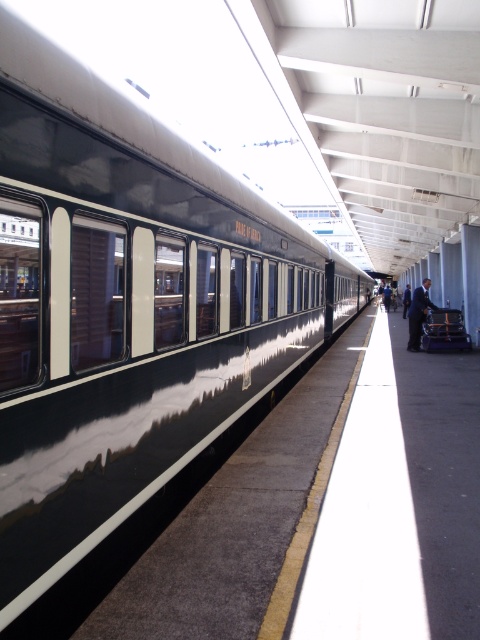
You are a photographer waiting at the train station platform. You want to take a photo of the dark blue suit at right and the black suit at right so that both are fully visible in the frame. Which suit should you position closer to the camera to ensure both are visible without cropping?

You should position the dark blue suit at right closer to the camera because it has a lesser width than the black suit at right, making it easier to fit both into the frame without cropping.

Consider the image. You are a passenger on the platform waiting for the train. You notice two people wearing suits. The dark blue suit at platform right and the black suit at right. Which person is shorter?

The dark blue suit at platform right is not as tall as the black suit at right, so the person wearing the dark blue suit at platform right is shorter.

You are a photographer waiting on the platform. You want to take a photo of the dark blue suit at platform right and black suit at right. Which one should you focus on first if you want to capture both in the same frame without moving the camera?

You should focus on the dark blue suit at platform right first because it is closer to the camera than the black suit at right, allowing both to be in the same frame without moving the camera.